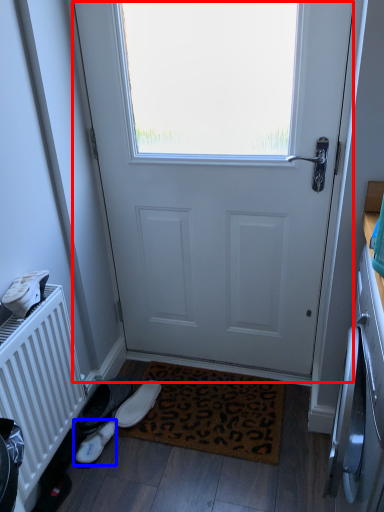
Question: Which point is closer to the camera, door (highlighted by a red box) or footwear (highlighted by a blue box)?

Choices:
 (A) door
 (B) footwear

Answer: (A)